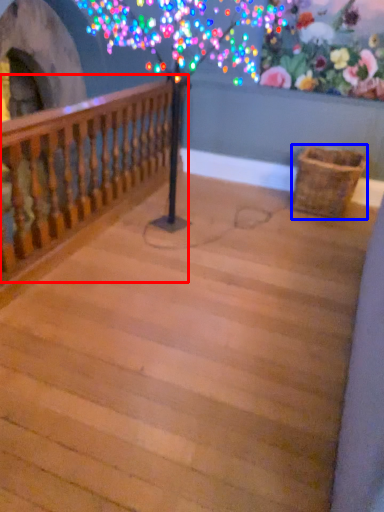
Question: Which of the following is the closest to the observer, rail (highlighted by a red box) or basket (highlighted by a blue box)?

Choices:
 (A) rail
 (B) basket

Answer: (A)